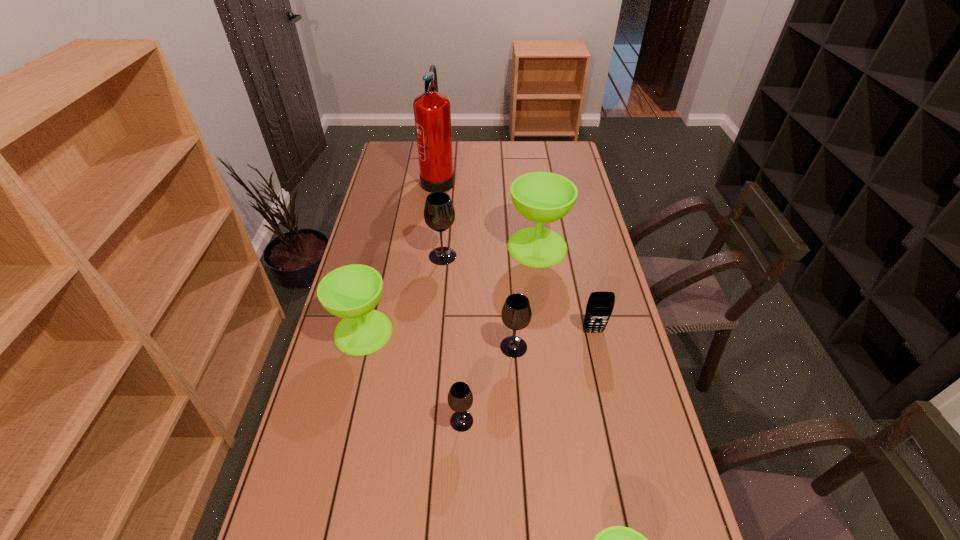
At what (x,y) coordinates should I click in order to perform the action: click on object that is positioned at the left edge. Please return your answer as a coordinate pair (x, y). This screenshot has height=540, width=960. Looking at the image, I should click on (351, 292).

The height and width of the screenshot is (540, 960). I want to click on wineglass at the right edge, so click(x=542, y=197).

Image resolution: width=960 pixels, height=540 pixels. I want to click on cellular telephone that is at the right edge, so click(600, 305).

Locate an element on the screen. This screenshot has height=540, width=960. vacant region at the far edge is located at coordinates (494, 148).

In the image, there is a desktop. Find the location of `vacant space at the left edge`. vacant space at the left edge is located at coordinates (350, 359).

Find the location of `free space at the right edge`. free space at the right edge is located at coordinates [563, 172].

The width and height of the screenshot is (960, 540). I want to click on free space at the far left corner of the desktop, so click(x=411, y=152).

Image resolution: width=960 pixels, height=540 pixels. In the image, there is a desktop. In order to click on vacant space at the far right corner in this screenshot , I will do `click(564, 160)`.

This screenshot has width=960, height=540. In order to click on blank region between the biggest gray wineglass and the second gray wineglass from right to left in this screenshot , I will do `click(452, 339)`.

Locate an element on the screen. Image resolution: width=960 pixels, height=540 pixels. free spot between the nearest gray wineglass and the cellular telephone is located at coordinates (527, 376).